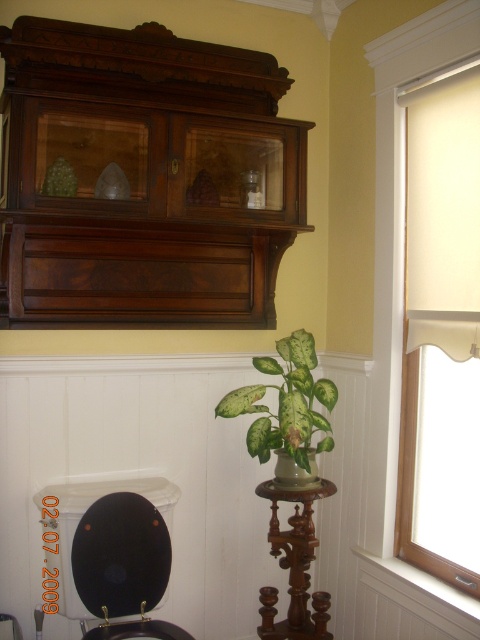
You are standing in the room depicted in the image. You notice a point at coordinate (442, 330). What object is located at that point?

The point at coordinate (442, 330) corresponds to the matte cream roller shade at right.

You are a delivery person who needs to place a package that is 2 feet wide between the mahogany wood chiffonier at upper left and the green matte leafy plant at center. Can you fit the package between them?

The mahogany wood chiffonier at upper left and green matte leafy plant at center are 21.69 inches apart. Since 2 feet equals 24 inches, the package is wider than the space between them. Therefore, the package cannot fit between them.

You are arranging a shelf in this room and need to place both the mahogany wood chiffonier at upper left and the green matte leafy plant at center. Given their widths, which object should you place first to ensure they fit properly?

The mahogany wood chiffonier at upper left should be placed first because it is wider than the green matte leafy plant at center, ensuring there is enough space for both items.